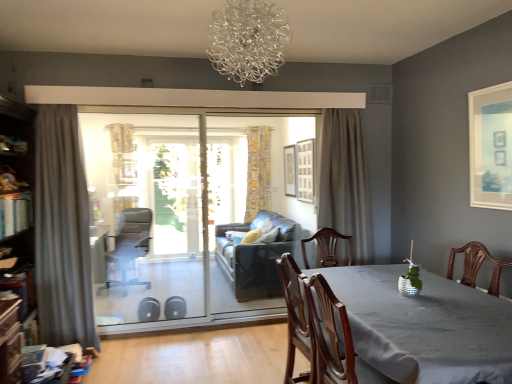
Question: From a real-world perspective, is leather swivel chair at left positioned under transparent glass screen door at center based on gravity?

Choices:
 (A) yes
 (B) no

Answer: (A)

Question: Is leather swivel chair at left thinner than transparent glass screen door at center?

Choices:
 (A) no
 (B) yes

Answer: (A)

Question: From the image's perspective, is leather swivel chair at left below transparent glass screen door at center?

Choices:
 (A) no
 (B) yes

Answer: (B)

Question: Considering the relative sizes of leather swivel chair at left and transparent glass screen door at center in the image provided, is leather swivel chair at left smaller than transparent glass screen door at center?

Choices:
 (A) yes
 (B) no

Answer: (B)

Question: Is transparent glass screen door at center at the back of leather swivel chair at left?

Choices:
 (A) yes
 (B) no

Answer: (B)

Question: From the image's perspective, is smooth gray table at center located above or below gray fabric curtain at left, positioned as the first curtain in left-to-right order?

Choices:
 (A) below
 (B) above

Answer: (A)

Question: Is smooth gray table at center in front of or behind gray fabric curtain at left, acting as the third curtain starting from the right, in the image?

Choices:
 (A) behind
 (B) front

Answer: (B)

Question: In the image, is smooth gray table at center on the left side or the right side of gray fabric curtain at left, the first curtain when ordered from front to back?

Choices:
 (A) left
 (B) right

Answer: (B)

Question: From a real-world perspective, is smooth gray table at center above or below gray fabric curtain at left, positioned as the first curtain in left-to-right order?

Choices:
 (A) below
 (B) above

Answer: (A)

Question: Would you say transparent glass screen door at center is inside or outside gray textured curtain at center, the 1th curtain in the right-to-left sequence?

Choices:
 (A) outside
 (B) inside

Answer: (A)

Question: Considering the positions of transparent glass screen door at center and gray textured curtain at center, arranged as the 3th curtain when viewed from the left, in the image, is transparent glass screen door at center wider or thinner than gray textured curtain at center, arranged as the 3th curtain when viewed from the left,?

Choices:
 (A) thin
 (B) wide

Answer: (A)

Question: Visually, is transparent glass screen door at center positioned to the left or to the right of gray textured curtain at center, the 1th curtain in the right-to-left sequence?

Choices:
 (A) right
 (B) left

Answer: (B)

Question: Relative to gray textured curtain at center, arranged as the 3th curtain when viewed from the left, is transparent glass screen door at center in front or behind?

Choices:
 (A) front
 (B) behind

Answer: (B)

Question: Which is correct: transparent glass screen door at center is inside matte white picture frame at upper right, the first picture frame positioned from the right, or outside of it?

Choices:
 (A) outside
 (B) inside

Answer: (A)

Question: Visually, is transparent glass screen door at center positioned to the left or to the right of matte white picture frame at upper right, the first picture frame positioned from the right?

Choices:
 (A) right
 (B) left

Answer: (B)